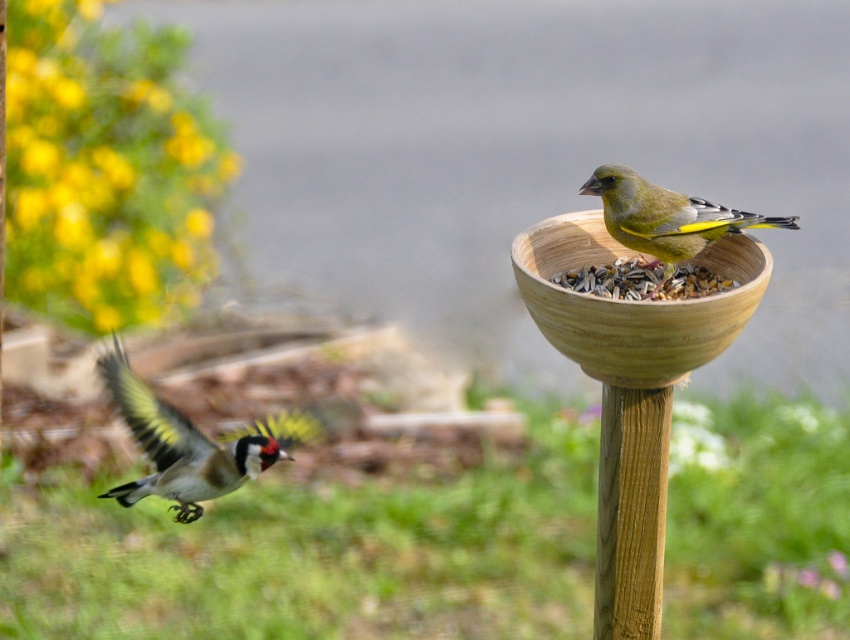
Question: Can you confirm if speckled feathered bird at left is positioned above yellow-green feathers at upper right?

Choices:
 (A) no
 (B) yes

Answer: (A)

Question: In this image, where is wooden bowl at upper right located relative to speckled feathered bird at left?

Choices:
 (A) left
 (B) right

Answer: (B)

Question: Estimate the real-world distances between objects in this image. Which object is closer to the yellow-green feathers at upper right?

Choices:
 (A) brown wooden bowl at upper right
 (B) wooden bowl at upper right

Answer: (A)

Question: Which point is closer to the camera?

Choices:
 (A) speckled feathered bird at left
 (B) brown wooden bowl at upper right

Answer: (B)

Question: Observing the image, what is the correct spatial positioning of wooden bowl at upper right in reference to speckled feathered bird at left?

Choices:
 (A) below
 (B) above

Answer: (B)

Question: Estimate the real-world distances between objects in this image. Which object is closer to the yellow-green feathers at upper right?

Choices:
 (A) brown wooden bowl at upper right
 (B) wooden bowl at upper right

Answer: (A)